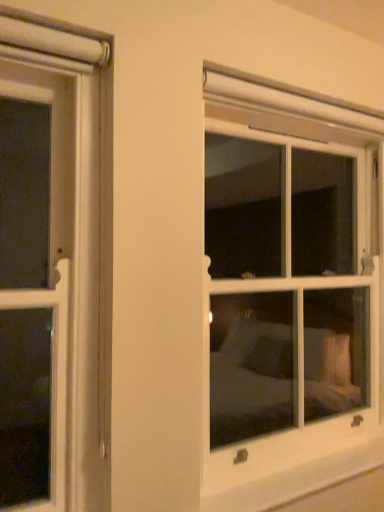
Question: Relative to clear glass window at center, is white plastic window sill at lower right in front or behind?

Choices:
 (A) behind
 (B) front

Answer: (B)

Question: From their relative heights in the image, would you say white plastic window sill at lower right is taller or shorter than clear glass window at center?

Choices:
 (A) tall
 (B) short

Answer: (B)

Question: Is point (377, 449) closer or farther from the camera than point (249, 162)?

Choices:
 (A) farther
 (B) closer

Answer: (B)

Question: From the image's perspective, is clear glass window at center located above or below white plastic window sill at lower right?

Choices:
 (A) below
 (B) above

Answer: (B)

Question: Relative to white plastic window sill at lower right, is clear glass window at center in front or behind?

Choices:
 (A) front
 (B) behind

Answer: (B)

Question: Is clear glass window at center taller or shorter than white plastic window sill at lower right?

Choices:
 (A) tall
 (B) short

Answer: (A)

Question: Is point (286, 177) positioned closer to the camera than point (263, 484)?

Choices:
 (A) closer
 (B) farther

Answer: (B)